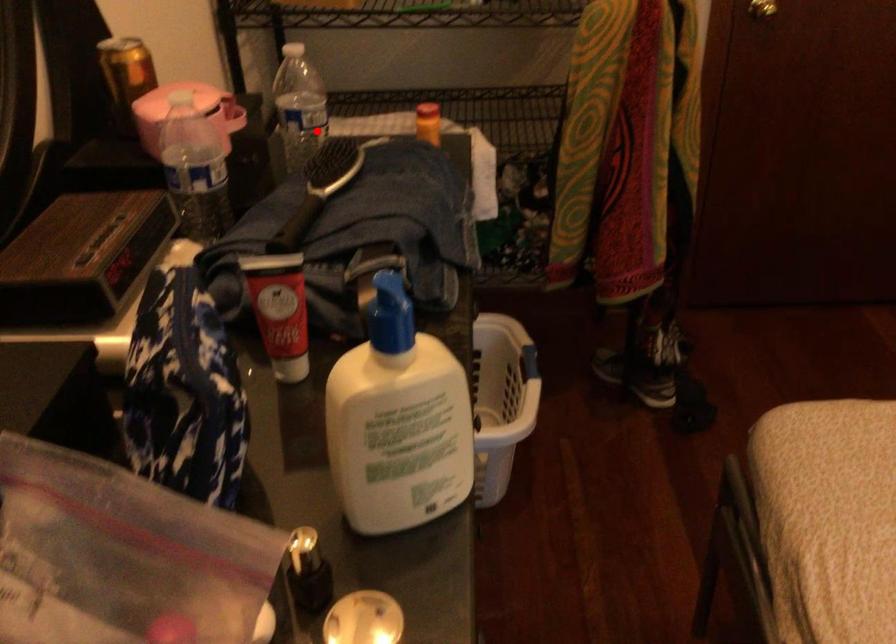
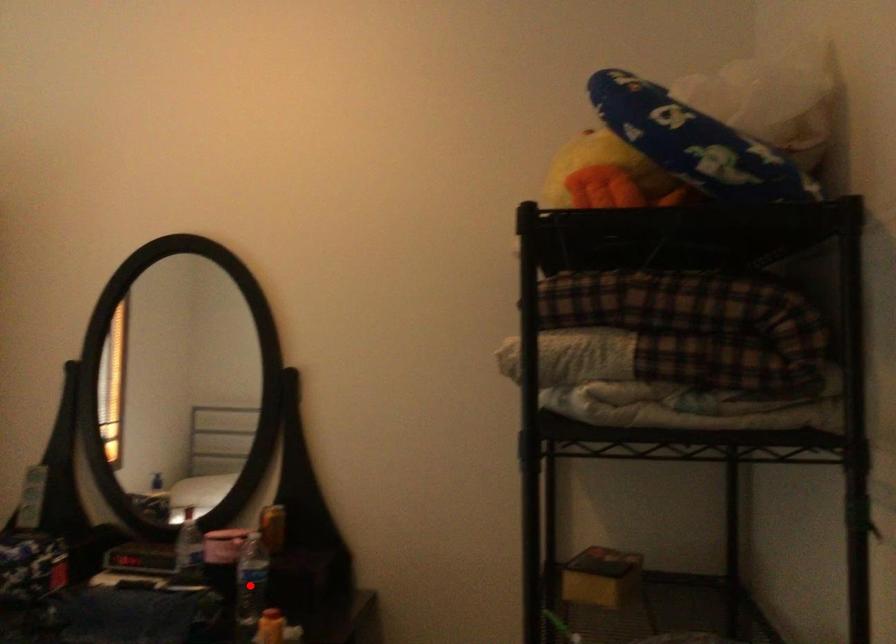
I am providing you with two images of the same scene from different viewpoints. A red point is marked on the first image and another point is marked on the second image. Is the marked point in image1 the same physical position as the marked point in image2?

Yes